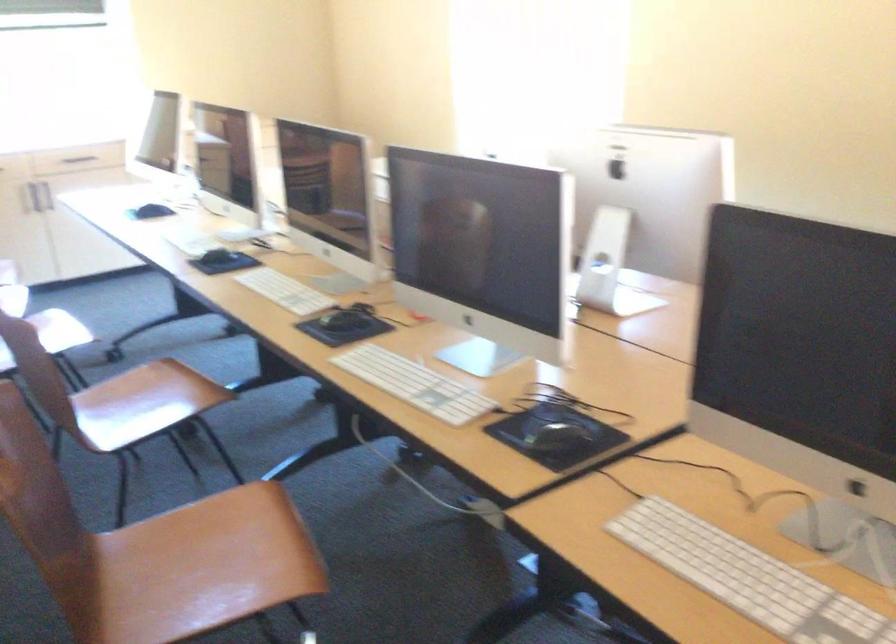
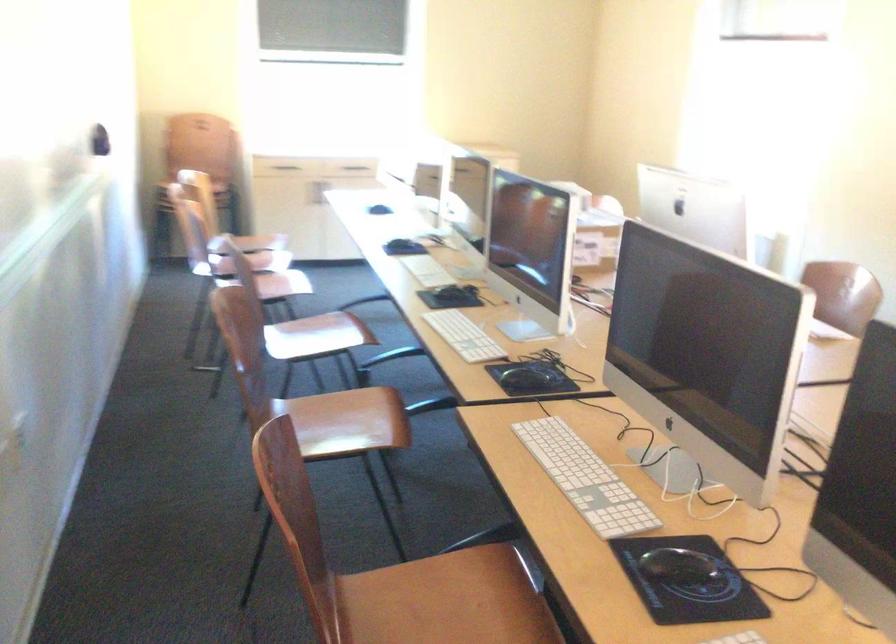
Question: The camera is either moving clockwise (left) or counter-clockwise (right) around the object. The first image is from the beginning of the video and the second image is from the end. Is the camera moving left or right when shooting the video?

Choices:
 (A) Left
 (B) Right

Answer: (B)